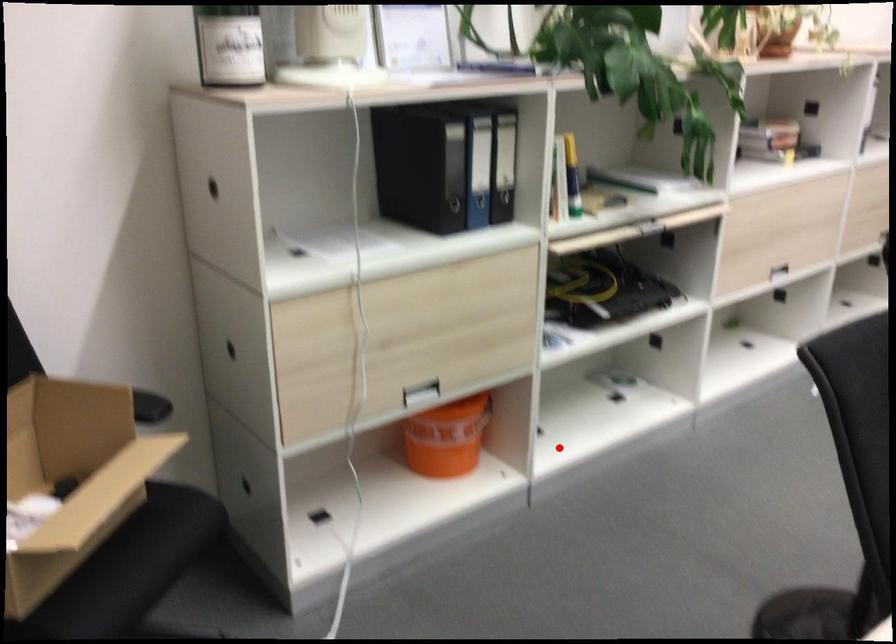
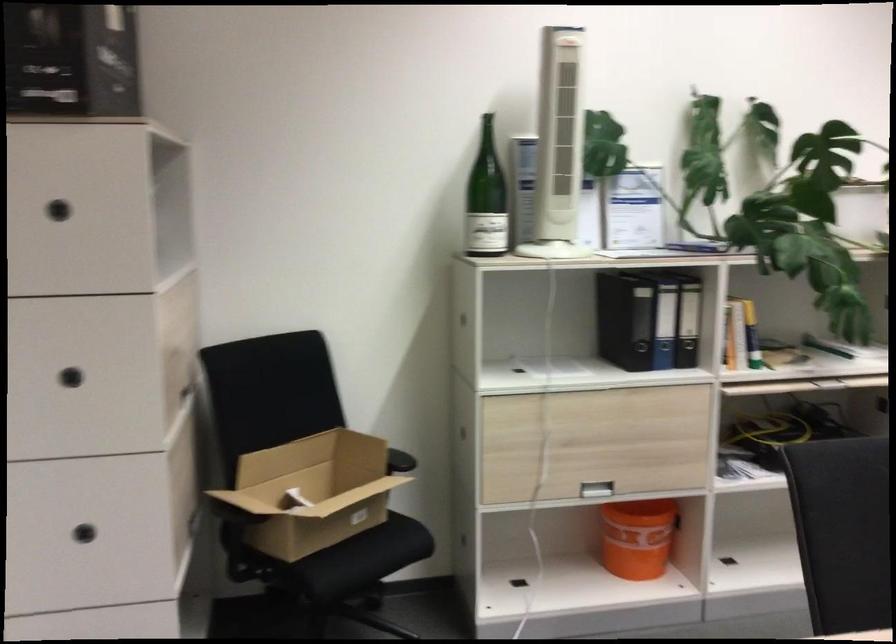
In the second image, find the point that corresponds to the highlighted location in the first image.

(738, 573)